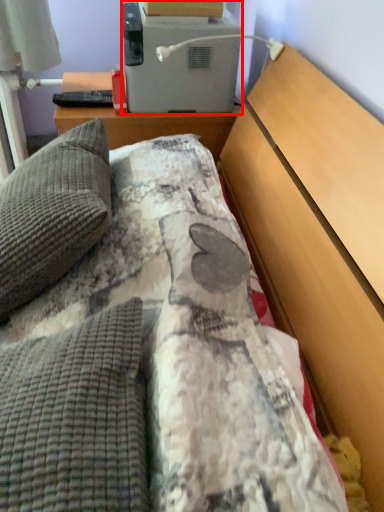
Question: From the image's perspective, where is appliance (annotated by the red box) located relative to pillow?

Choices:
 (A) above
 (B) below

Answer: (A)